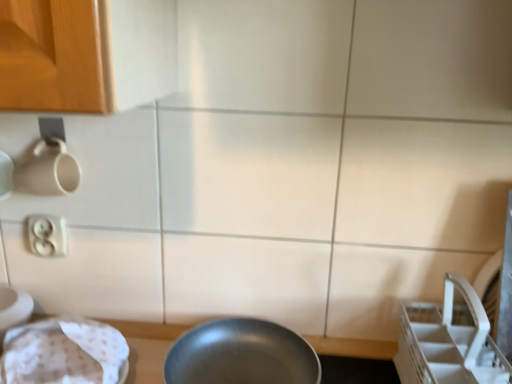
Question: Considering the relative positions of shiny silver frying pan at center and transparent plastic sink at lower left in the image provided, is shiny silver frying pan at center to the left or to the right of transparent plastic sink at lower left?

Choices:
 (A) left
 (B) right

Answer: (B)

Question: Is shiny silver frying pan at center in front of or behind transparent plastic sink at lower left in the image?

Choices:
 (A) front
 (B) behind

Answer: (B)

Question: Which of these objects is positioned farthest from the transparent plastic sink at lower left?

Choices:
 (A) shiny silver frying pan at center
 (B) white plastic electric outlet at upper left

Answer: (A)

Question: Based on their relative distances, which object is nearer to the shiny silver frying pan at center?

Choices:
 (A) white plastic electric outlet at upper left
 (B) transparent plastic sink at lower left

Answer: (B)